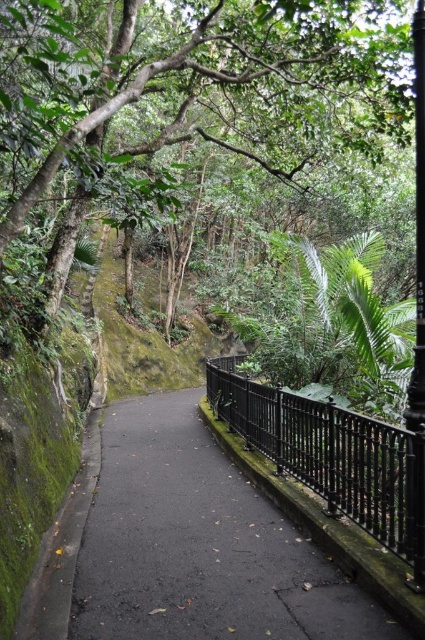
Is black asphalt pavement at center bigger than green leafy tree at center?

No, black asphalt pavement at center is not bigger than green leafy tree at center.

Does black asphalt pavement at center appear on the left side of green leafy tree at center?

Yes, black asphalt pavement at center is to the left of green leafy tree at center.

Does point (139, 616) come closer to viewer compared to point (234, 44)?

Yes, it is in front of point (234, 44).

Locate an element on the screen. This screenshot has height=640, width=425. black asphalt pavement at center is located at coordinates (198, 545).

Does black asphalt pavement at center appear on the right side of black wrought iron fence at center?

In fact, black asphalt pavement at center is to the left of black wrought iron fence at center.

Find the location of a particular element. The width and height of the screenshot is (425, 640). black asphalt pavement at center is located at coordinates (198, 545).

Locate an element on the screen. black asphalt pavement at center is located at coordinates (198, 545).

Between green leafy tree at center and black wrought iron fence at center, which one is positioned lower?

black wrought iron fence at center is lower down.

Between point (353, 100) and point (380, 461), which one is positioned behind?

Point (353, 100)

You are a GUI agent. You are given a task and a screenshot of the screen. Output one action in this format:
    pyautogui.click(x=<x>, y=<y>)
    Task: Click on the green leafy tree at center
    
    Given the screenshot: What is the action you would take?
    pyautogui.click(x=204, y=81)